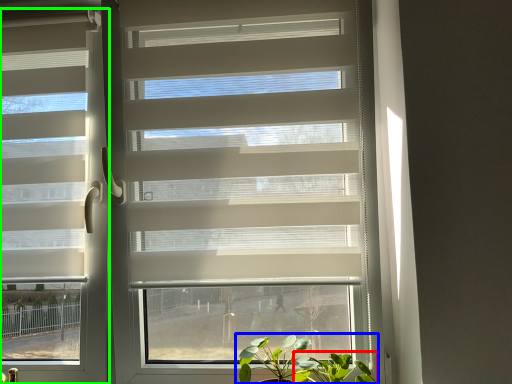
Question: Which object is the farthest from vegetation (highlighted by a red box)? Choose among these: houseplant (highlighted by a blue box) or window blind (highlighted by a green box).

Choices:
 (A) houseplant
 (B) window blind

Answer: (B)